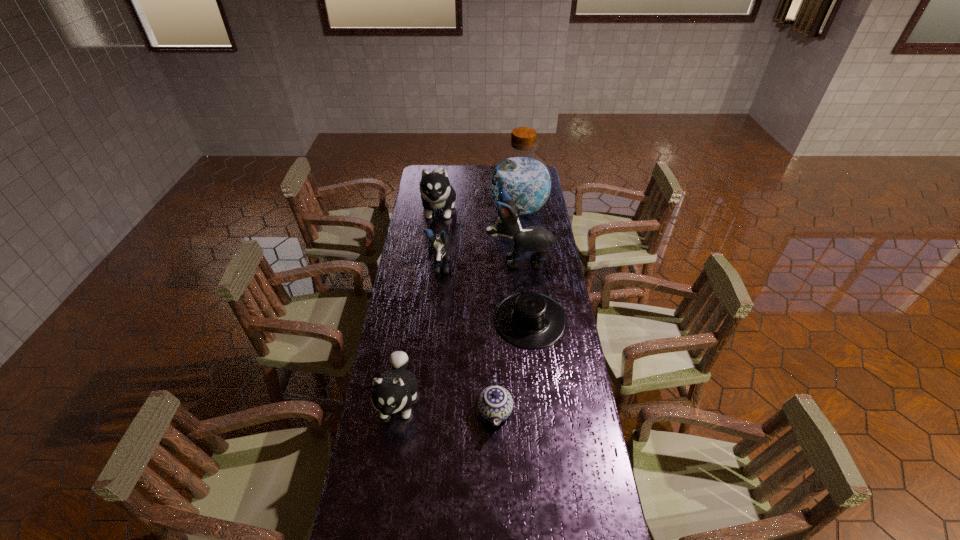
Locate an element on the screen. free space between the water jug and the smaller black puppy is located at coordinates (479, 239).

At what (x,y) coordinates should I click in order to perform the action: click on empty space that is in between the blue chinaware and the black dress hat. Please return your answer as a coordinate pair (x, y). Looking at the image, I should click on (513, 366).

Choose which object is the third nearest neighbor to the black dress hat. Please provide its 2D coordinates. Your answer should be formatted as a tuple, i.e. [(x, y)], where the tuple contains the x and y coordinates of a point satisfying the conditions above.

[(440, 243)]

This screenshot has width=960, height=540. In order to click on the fourth closest object relative to the water jug in this screenshot , I will do `click(529, 320)`.

Identify which puppy is the second nearest to the left black puppy. Please provide its 2D coordinates. Your answer should be formatted as a tuple, i.e. [(x, y)], where the tuple contains the x and y coordinates of a point satisfying the conditions above.

[(436, 192)]

Select which puppy is the fourth closest to the blue water jug. Please provide its 2D coordinates. Your answer should be formatted as a tuple, i.e. [(x, y)], where the tuple contains the x and y coordinates of a point satisfying the conditions above.

[(395, 390)]

The height and width of the screenshot is (540, 960). Find the location of `vacant area in the image that satisfies the following two spatial constraints: 1. at the face of the black dress hat; 2. on the left side of the farther white puppy`. vacant area in the image that satisfies the following two spatial constraints: 1. at the face of the black dress hat; 2. on the left side of the farther white puppy is located at coordinates (425, 321).

The height and width of the screenshot is (540, 960). Identify the location of free space that satisfies the following two spatial constraints: 1. on the front-facing side of the right black puppy; 2. on the front-facing side of the left black puppy. (520, 268).